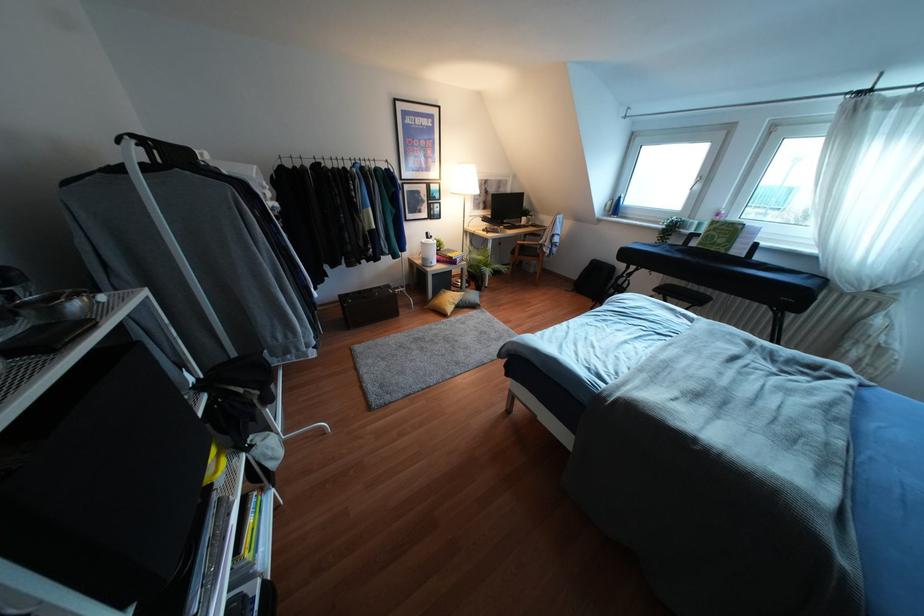
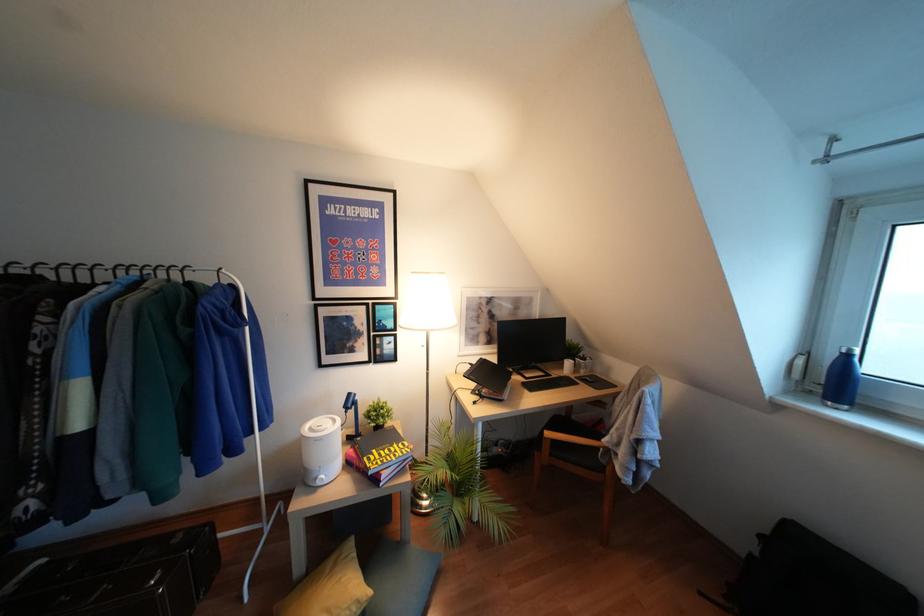
What movement of the cameraman would produce the second image?

The movement direction of the cameraman is right, forward.